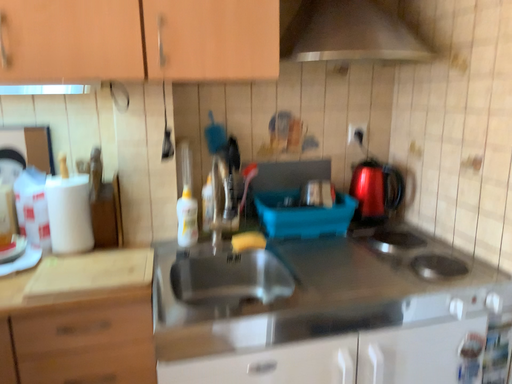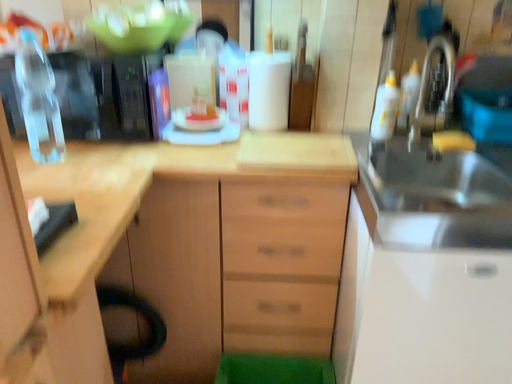
Question: How did the camera likely rotate when shooting the video?

Choices:
 (A) rotated upward
 (B) rotated downward

Answer: (B)